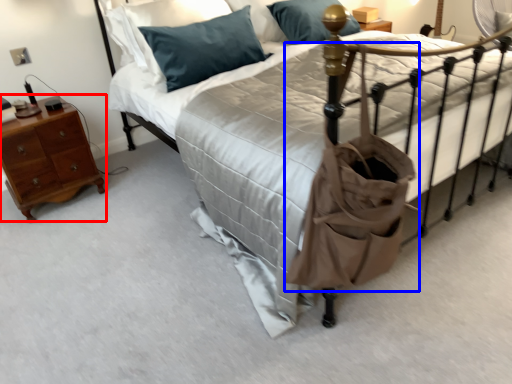
Question: Among these objects, which one is nearest to the camera, nightstand (highlighted by a red box) or bag (highlighted by a blue box)?

Choices:
 (A) nightstand
 (B) bag

Answer: (B)